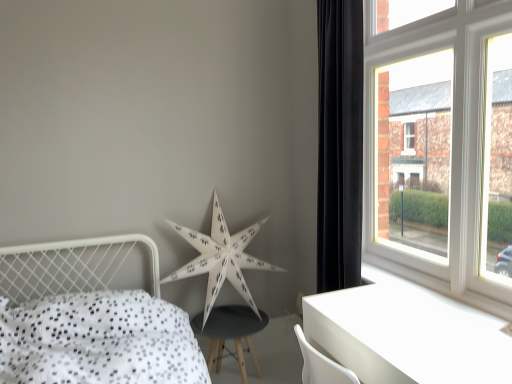
The height and width of the screenshot is (384, 512). What do you see at coordinates (339, 144) in the screenshot?
I see `black velvet curtain at right` at bounding box center [339, 144].

This screenshot has height=384, width=512. Describe the element at coordinates (440, 142) in the screenshot. I see `white wooden window at upper right` at that location.

The width and height of the screenshot is (512, 384). I want to click on white dotted fabric bed at lower left, so click(106, 341).

Image resolution: width=512 pixels, height=384 pixels. I want to click on black velvet curtain at right, so pyautogui.click(x=339, y=144).

Is white dotted fabric bed at lower left far from white paper star at center?

They are positioned close to each other.

Is the position of white dotted fabric bed at lower left less distant than that of white paper star at center?

Yes, white dotted fabric bed at lower left is closer to the camera.

Based on the photo, which is less distant, (18, 311) or (198, 257)?

Clearly, point (18, 311) is closer to the camera than point (198, 257).

Which is more distant, (34, 285) or (406, 70)?

The point (34, 285) is more distant.

Considering the sizes of objects white dotted fabric bed at lower left and white wooden window at upper right in the image provided, who is taller, white dotted fabric bed at lower left or white wooden window at upper right?

white wooden window at upper right is taller.

Identify the location of window on the right of white dotted fabric bed at lower left. The height and width of the screenshot is (384, 512). (440, 142).

Is white dotted fabric bed at lower left wider or thinner than white wooden window at upper right?

In the image, white dotted fabric bed at lower left appears to be wider than white wooden window at upper right.

Consider the image. Considering the relative positions of white dotted fabric bed at lower left and black velvet curtain at right in the image provided, is white dotted fabric bed at lower left behind black velvet curtain at right?

That is False.

Considering the relative sizes of white dotted fabric bed at lower left and black velvet curtain at right in the image provided, is white dotted fabric bed at lower left shorter than black velvet curtain at right?

Yes, white dotted fabric bed at lower left is shorter than black velvet curtain at right.

Considering the points (175, 360) and (321, 89), which point is behind, point (175, 360) or point (321, 89)?

The point (321, 89) is more distant.

How much distance is there between white dotted fabric bed at lower left and black velvet curtain at right?

They are 1.23 meters apart.

Considering the sizes of objects white wooden window at upper right and black velvet curtain at right in the image provided, who is smaller, white wooden window at upper right or black velvet curtain at right?

black velvet curtain at right is smaller.

Which is closer, (367,213) or (356,273)?

Point (367,213) is positioned farther from the camera compared to point (356,273).

Can black velvet curtain at right be found inside white wooden window at upper right?

No, black velvet curtain at right is not surrounded by white wooden window at upper right.

Is black velvet curtain at right at the back of white wooden window at upper right?

Yes, white wooden window at upper right is facing away from black velvet curtain at right.

Is white glossy table at lower right positioned with its back to white dotted fabric bed at lower left?

No, white glossy table at lower right is not facing the opposite direction of white dotted fabric bed at lower left.

Image resolution: width=512 pixels, height=384 pixels. Find the location of `bed below the white glossy table at lower right (from the image's perspective)`. bed below the white glossy table at lower right (from the image's perspective) is located at coordinates (106, 341).

Is white glossy table at lower right beside white dotted fabric bed at lower left?

There is a gap between white glossy table at lower right and white dotted fabric bed at lower left.

From the picture: Which of these two, white paper star at center or white glossy table at lower right, stands shorter?

With less height is white glossy table at lower right.

Does white paper star at center have a greater width compared to white glossy table at lower right?

No.

Is white paper star at center behind white glossy table at lower right?

Yes.

From a real-world perspective, which object stands above the other?

white paper star at center, from a real-world perspective.

Who is smaller, black velvet curtain at right or white dotted fabric bed at lower left?

black velvet curtain at right is smaller.

This screenshot has height=384, width=512. I want to click on curtain on the right of white dotted fabric bed at lower left, so click(339, 144).

Is black velvet curtain at right spatially inside white dotted fabric bed at lower left, or outside of it?

black velvet curtain at right cannot be found inside white dotted fabric bed at lower left.

I want to click on star behind the white dotted fabric bed at lower left, so click(221, 258).

What are the coordinates of `bed below the white wooden window at upper right (from a real-world perspective)` in the screenshot? It's located at (106, 341).

When comparing their distances from white glossy table at lower right, does white dotted fabric bed at lower left or white paper star at center seem further?

Based on the image, white paper star at center appears to be further to white glossy table at lower right.

When comparing their distances from white dotted fabric bed at lower left, does black velvet curtain at right or white wooden window at upper right seem closer?

The object closer to white dotted fabric bed at lower left is black velvet curtain at right.

Considering their positions, is white glossy table at lower right positioned closer to white dotted fabric bed at lower left than black velvet curtain at right?

white glossy table at lower right.

Based on their spatial positions, is white glossy table at lower right or white paper star at center further from black velvet curtain at right?

Among the two, white paper star at center is located further to black velvet curtain at right.

Consider the image. Which object lies further to the anchor point white paper star at center, white wooden window at upper right or white glossy table at lower right?

white wooden window at upper right is further to white paper star at center.

From the image, which object appears to be farther from black velvet curtain at right, white dotted fabric bed at lower left or white paper star at center?

Based on the image, white dotted fabric bed at lower left appears to be further to black velvet curtain at right.

From the image, which object appears to be farther from white wooden window at upper right, white paper star at center or white dotted fabric bed at lower left?

white dotted fabric bed at lower left lies further to white wooden window at upper right than the other object.

Estimate the real-world distances between objects in this image. Which object is closer to black velvet curtain at right, white dotted fabric bed at lower left or white glossy table at lower right?

white glossy table at lower right is positioned closer to the anchor black velvet curtain at right.

You are a GUI agent. You are given a task and a screenshot of the screen. Output one action in this format:
    pyautogui.click(x=<x>, y=<y>)
    Task: Click on the table between white dotted fabric bed at lower left and white paper star at center in the front-back direction
    Image resolution: width=512 pixels, height=384 pixels.
    Given the screenshot: What is the action you would take?
    pyautogui.click(x=407, y=336)

This screenshot has height=384, width=512. Identify the location of table between white dotted fabric bed at lower left and white wooden window at upper right. (407, 336).

At what (x,y) coordinates should I click in order to perform the action: click on curtain between white wooden window at upper right and white glossy table at lower right in the up-down direction. Please return your answer as a coordinate pair (x, y). This screenshot has height=384, width=512. Looking at the image, I should click on (339, 144).

You are a GUI agent. You are given a task and a screenshot of the screen. Output one action in this format:
    pyautogui.click(x=<x>, y=<y>)
    Task: Click on the curtain positioned between white glossy table at lower right and white paper star at center from near to far
    
    Given the screenshot: What is the action you would take?
    pyautogui.click(x=339, y=144)